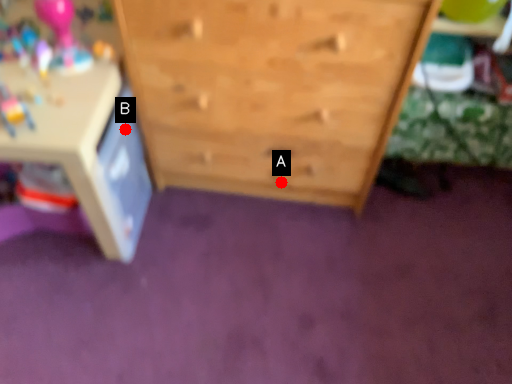
Question: Two points are circled on the image, labeled by A and B beside each circle. Which point is closer to the camera?

Choices:
 (A) A is closer
 (B) B is closer

Answer: (B)